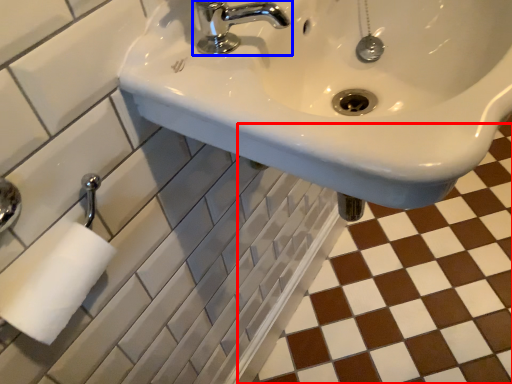
Question: Which object is closer to the camera taking this photo, ceramic tile (highlighted by a red box) or tap (highlighted by a blue box)?

Choices:
 (A) ceramic tile
 (B) tap

Answer: (B)